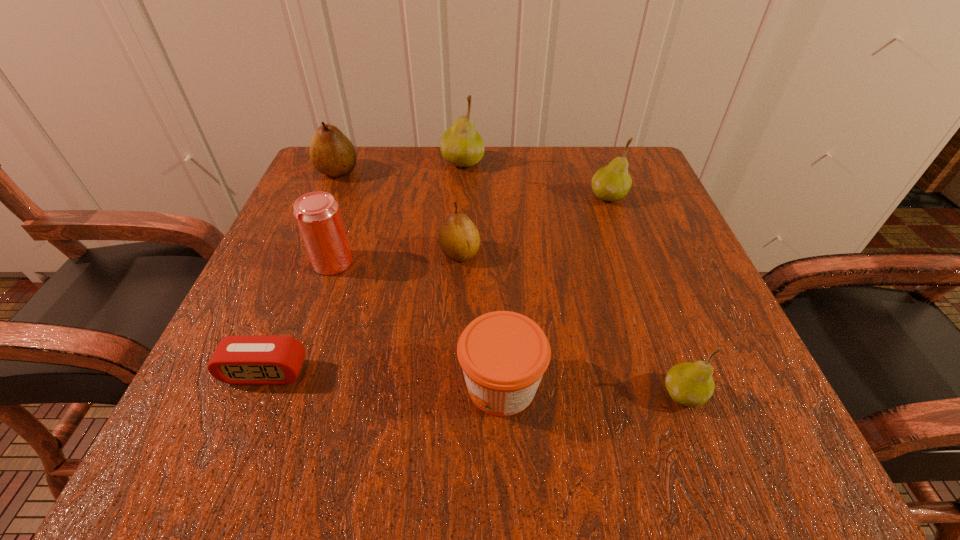
Where is `the nearest green pear`? the nearest green pear is located at coordinates (690, 384).

The width and height of the screenshot is (960, 540). I want to click on jam, so click(x=503, y=354).

Where is `pink alarm clock`? The width and height of the screenshot is (960, 540). pink alarm clock is located at coordinates (245, 359).

Identify the location of the shortest object. (245, 359).

At what (x,y) coordinates should I click in order to perform the action: click on free region located 0.160m on the right of the farthest green pear. Please return your answer as a coordinate pair (x, y). Looking at the image, I should click on click(x=553, y=162).

Identify the location of vacant region located on the front of the leftmost pear. (323, 208).

In order to click on free space located on the left of the third nearest pear in this screenshot , I will do `click(523, 197)`.

This screenshot has width=960, height=540. Find the location of `free space located on the front of the beer can`. free space located on the front of the beer can is located at coordinates (301, 353).

Locate an element on the screen. This screenshot has width=960, height=540. vacant space located on the front of the smaller brown pear is located at coordinates (457, 315).

I want to click on vacant area situated 0.220m on the back of the smallest green pear, so click(637, 267).